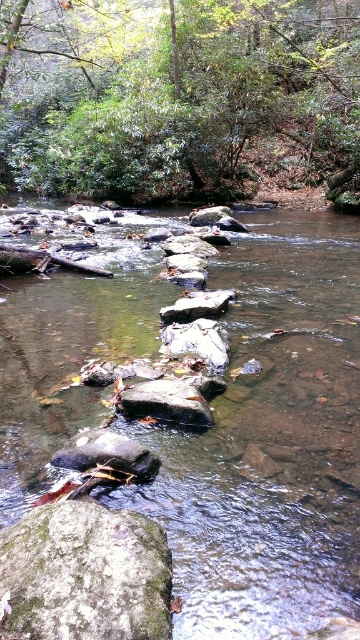
You are a hiker trying to cross the stream using the stepping stones. You notice the smooth rock stream at center and the green leafy tree at upper center. Which object is positioned higher in the image?

The green leafy tree at upper center is positioned higher in the image than the smooth rock stream at center.